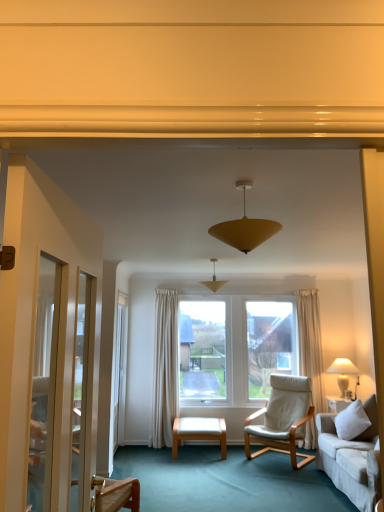
Identify the location of white leather ottoman at center. This screenshot has height=512, width=384. (x=199, y=432).

What do you see at coordinates (214, 280) in the screenshot? I see `matte yellow cone at center, the 2th lamp viewed from the top` at bounding box center [214, 280].

In order to face white leather chair at center, should I rotate leftwards or rightwards?

Turn right by 11.542 degrees to look at white leather chair at center.

What is the approximate width of white leather chair at center?

The width of white leather chair at center is 34.53 inches.

In order to click on white fabric pillow at lower right in this screenshot , I will do `click(351, 421)`.

Image resolution: width=384 pixels, height=512 pixels. Find the location of `white leather ottoman at center`. white leather ottoman at center is located at coordinates (199, 432).

Identify the location of chair above the white leather ottoman at center (from the image's perspective). This screenshot has width=384, height=512. (282, 419).

Based on the photo, measure the distance from white leather ottoman at center to white leather chair at center.

The distance of white leather ottoman at center from white leather chair at center is 76.30 centimeters.

Between white leather ottoman at center and white leather chair at center, which one has larger size?

Bigger between the two is white leather chair at center.

From a real-world perspective, who is located higher, white leather ottoman at center or white leather chair at center?

white leather chair at center is physically above.

Is matte yellow cone at center, the 2th lamp viewed from the top, in front of or behind white glossy screen door at left in the image?

Visually, matte yellow cone at center, the 2th lamp viewed from the top, is located in front of white glossy screen door at left.

Is matte yellow cone at center, arranged as the 2th lamp when viewed from the front, turned away from white glossy screen door at left?

matte yellow cone at center, arranged as the 2th lamp when viewed from the front, does not have its back to white glossy screen door at left.

Can you confirm if matte yellow cone at center, arranged as the 2th lamp when viewed from the front, is smaller than white glossy screen door at left?

Yes.

Between matte yellow cone at center, arranged as the 2th lamp when viewed from the front, and white glossy screen door at left, which one appears on the left side from the viewer's perspective?

Positioned to the left is white glossy screen door at left.

Considering the positions of points (244, 246) and (289, 419), is point (244, 246) farther from camera compared to point (289, 419)?

That is False.

What's the angular difference between matte yellow cone at center, which appears as the 1th lamp when viewed from the left, and white leather chair at center's facing directions?

130 degrees.

Can you confirm if matte yellow cone at center, which is the 3th lamp in bottom-to-top order, is thinner than white leather chair at center?

Yes, matte yellow cone at center, which is the 3th lamp in bottom-to-top order, is thinner than white leather chair at center.

Does matte yellow cone at center, which is the 3th lamp in bottom-to-top order, lie behind white leather chair at center?

No, matte yellow cone at center, which is the 3th lamp in bottom-to-top order, is closer to the viewer.

Does white fabric pillow at lower right contain white fabric lampshade at right, marked as the 3th lamp in a top-to-bottom arrangement?

Actually, white fabric lampshade at right, marked as the 3th lamp in a top-to-bottom arrangement, is outside white fabric pillow at lower right.

Is point (359, 426) more distant than point (346, 368)?

No, it is not.

Which object is closer to the camera taking this photo, white fabric pillow at lower right or white fabric lampshade at right, the 3th lamp positioned from the left?

Positioned in front is white fabric pillow at lower right.

From the image's perspective, would you say white leather ottoman at center is shown under white fabric lampshade at right, the 1th lamp viewed from the back?

Yes, from the image's perspective, white leather ottoman at center is beneath white fabric lampshade at right, the 1th lamp viewed from the back.

From the picture: Can you confirm if white leather ottoman at center is thinner than white fabric lampshade at right, the 1th lamp from the right?

No, white leather ottoman at center is not thinner than white fabric lampshade at right, the 1th lamp from the right.

Is white leather ottoman at center facing away from white fabric lampshade at right, the 3th lamp positioned from the left?

white leather ottoman at center is not turned away from white fabric lampshade at right, the 3th lamp positioned from the left.

From a real-world perspective, which object stands above the other?

white glossy screen door at left, from a real-world perspective.

Where is `chair below the white glossy screen door at left (from the image's perspective)`? Image resolution: width=384 pixels, height=512 pixels. chair below the white glossy screen door at left (from the image's perspective) is located at coordinates (282, 419).

Is white glossy screen door at left touching white leather chair at center?

No.

Is the depth of white glossy screen door at left less than that of white leather chair at center?

No, white glossy screen door at left is behind white leather chair at center.

Is white fabric pillow at lower right taller or shorter than white leather chair at center?

In the image, white fabric pillow at lower right appears to be shorter than white leather chair at center.

From the image's perspective, relative to white leather chair at center, is white fabric pillow at lower right above or below?

From the image's perspective, white fabric pillow at lower right appears above white leather chair at center.

From the picture: Considering their positions, is white fabric pillow at lower right located in front of or behind white leather chair at center?

white fabric pillow at lower right is in front of white leather chair at center.

From a real-world perspective, relative to white leather chair at center, is white fabric pillow at lower right vertically above or below?

white fabric pillow at lower right is situated higher than white leather chair at center in the real world.

At what (x,y) coordinates should I click in order to perform the action: click on table behind the white leather chair at center. Please return your answer as a coordinate pair (x, y). The height and width of the screenshot is (512, 384). Looking at the image, I should click on (199, 432).

You are a GUI agent. You are given a task and a screenshot of the screen. Output one action in this format:
    pyautogui.click(x=<x>, y=<y>)
    Task: Click on the screen door that appears below the matte yellow cone at center, acting as the 2th lamp starting from the right (from a real-world perspective)
    
    Given the screenshot: What is the action you would take?
    pyautogui.click(x=120, y=370)

Based on their spatial positions, is white fabric pillow at lower right or white fabric lampshade at right, the 3th lamp positioned from the left, further from white leather chair at center?

white fabric pillow at lower right.

When comparing their distances from white glossy screen door at left, does white leather chair at center or white leather ottoman at center seem further?

Based on the image, white leather chair at center appears to be further to white glossy screen door at left.

Estimate the real-world distances between objects in this image. Which object is closer to matte yellow cone at center, acting as the 2th lamp starting from the right, white glossy screen door at left or white leather ottoman at center?

Based on the image, white glossy screen door at left appears to be nearer to matte yellow cone at center, acting as the 2th lamp starting from the right.

Looking at the image, which one is located further to white leather ottoman at center, white glossy screen door at left or matte yellow cone at center, which appears as the 1th lamp when viewed from the left?

matte yellow cone at center, which appears as the 1th lamp when viewed from the left, lies further to white leather ottoman at center than the other object.

Considering their positions, is matte yellow cone at center, which appears as the 1th lamp when viewed from the left, positioned further to white fabric lampshade at right, marked as the 3th lamp in a top-to-bottom arrangement, than white glossy screen door at left?

matte yellow cone at center, which appears as the 1th lamp when viewed from the left, is further to white fabric lampshade at right, marked as the 3th lamp in a top-to-bottom arrangement.

When comparing their distances from white glossy screen door at left, does white fabric pillow at lower right or white leather ottoman at center seem further?

Among the two, white fabric pillow at lower right is located further to white glossy screen door at left.

Consider the image. When comparing their distances from white fabric pillow at lower right, does white glossy screen door at left or white leather ottoman at center seem further?

Based on the image, white glossy screen door at left appears to be further to white fabric pillow at lower right.

Based on the photo, when comparing their distances from white glossy screen door at left, does white leather ottoman at center or matte yellow cone at center, acting as the second lamp starting from the bottom, seem further?

matte yellow cone at center, acting as the second lamp starting from the bottom.

Where is `lamp between matte yellow cone at center, which ranks as the second lamp in left-to-right order, and white leather ottoman at center, in the vertical direction`? This screenshot has height=512, width=384. lamp between matte yellow cone at center, which ranks as the second lamp in left-to-right order, and white leather ottoman at center, in the vertical direction is located at coordinates (344, 373).

Locate an element on the screen. This screenshot has width=384, height=512. table located between white glossy screen door at left and white fabric lampshade at right, placed as the 3th lamp when sorted from front to back, in the left-right direction is located at coordinates (199, 432).

Where is `pillow between white glossy screen door at left and white fabric lampshade at right, the 3th lamp positioned from the left, in the horizontal direction`? This screenshot has width=384, height=512. pillow between white glossy screen door at left and white fabric lampshade at right, the 3th lamp positioned from the left, in the horizontal direction is located at coordinates (351, 421).

The image size is (384, 512). I want to click on pillow between matte yellow cone at center, acting as the 1th lamp starting from the top, and white fabric lampshade at right, marked as the 3th lamp in a top-to-bottom arrangement, along the z-axis, so click(351, 421).